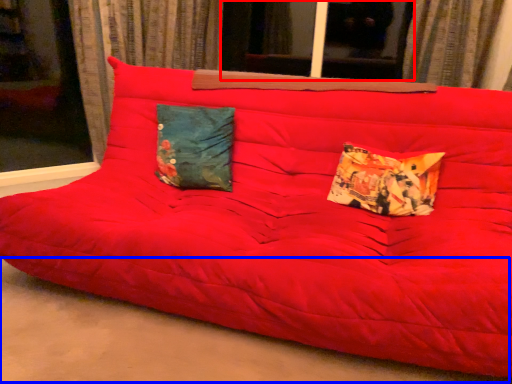
Question: Which object is further to the camera taking this photo, window (highlighted by a red box) or concrete (highlighted by a blue box)?

Choices:
 (A) window
 (B) concrete

Answer: (A)